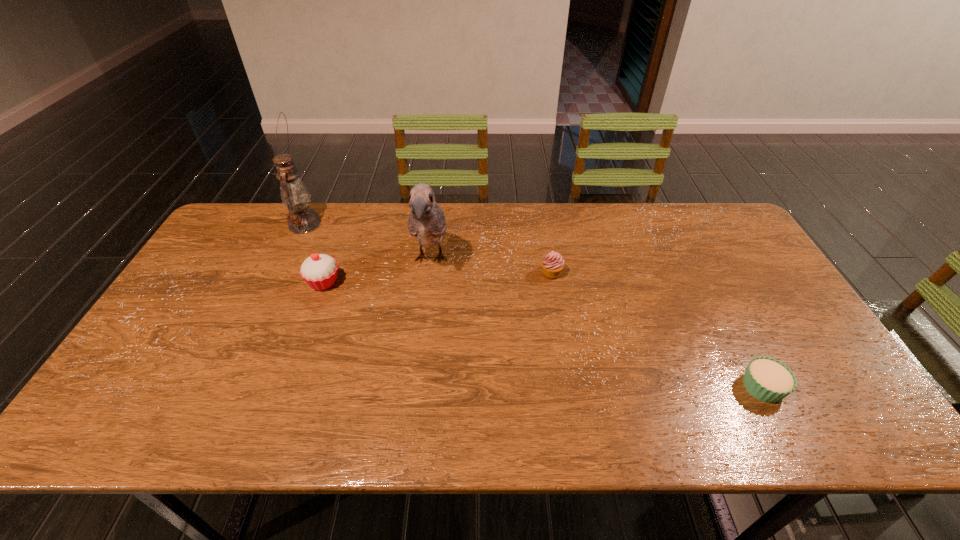
Find the location of `vacant region located on the front of the oil lamp`. vacant region located on the front of the oil lamp is located at coordinates (262, 316).

Locate an element on the screen. The image size is (960, 540). vacant area situated 0.220m on the front-facing side of the third object from right to left is located at coordinates (420, 352).

This screenshot has width=960, height=540. In order to click on vacant area situated 0.330m on the front of the fourth object from right to left in this screenshot , I will do `click(282, 399)`.

Where is `vacant space located 0.180m on the right of the second object from right to left`? vacant space located 0.180m on the right of the second object from right to left is located at coordinates (623, 273).

You are a GUI agent. You are given a task and a screenshot of the screen. Output one action in this format:
    pyautogui.click(x=<x>, y=<y>)
    Task: Click on the vacant region located 0.070m on the front of the nearest object
    This screenshot has height=540, width=960.
    Given the screenshot: What is the action you would take?
    [x=788, y=435]

Find the location of `oil lamp present at the far edge`. oil lamp present at the far edge is located at coordinates (294, 194).

Where is `parrot located in the far edge section of the desktop`? This screenshot has height=540, width=960. parrot located in the far edge section of the desktop is located at coordinates (426, 222).

At what (x,y) coordinates should I click in order to perform the action: click on object at the near edge. Please return your answer as a coordinate pair (x, y). Looking at the image, I should click on (767, 379).

Identify the location of object at the right edge. (767, 379).

At what (x,y) coordinates should I click in order to perform the action: click on object at the near right corner. Please return your answer as a coordinate pair (x, y). This screenshot has height=540, width=960. Looking at the image, I should click on (767, 379).